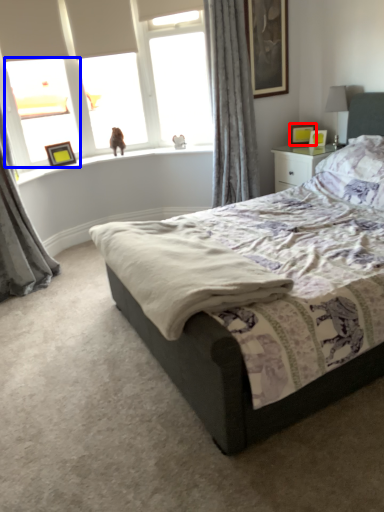
Question: Which object appears closest to the camera in this image, picture frame (highlighted by a red box) or window (highlighted by a blue box)?

Choices:
 (A) picture frame
 (B) window

Answer: (B)